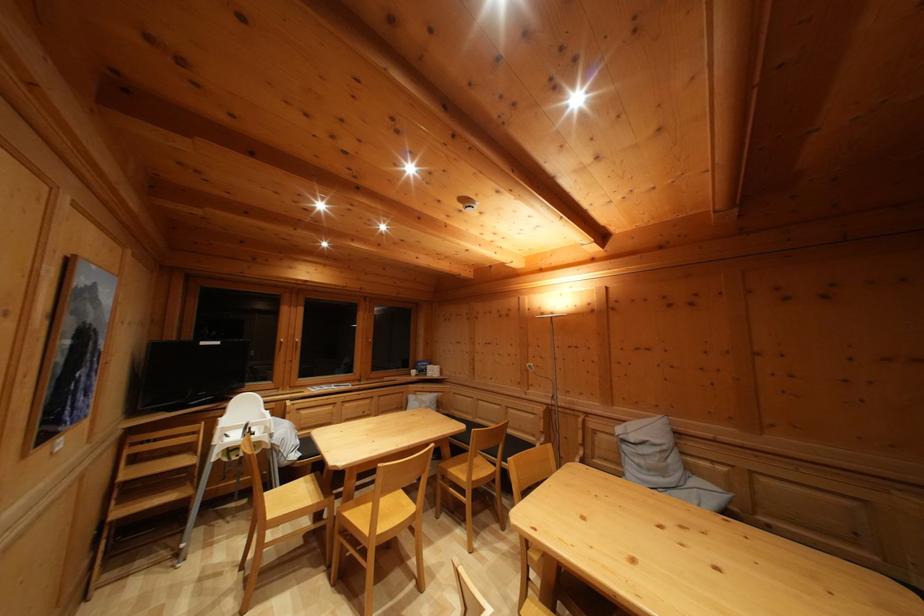
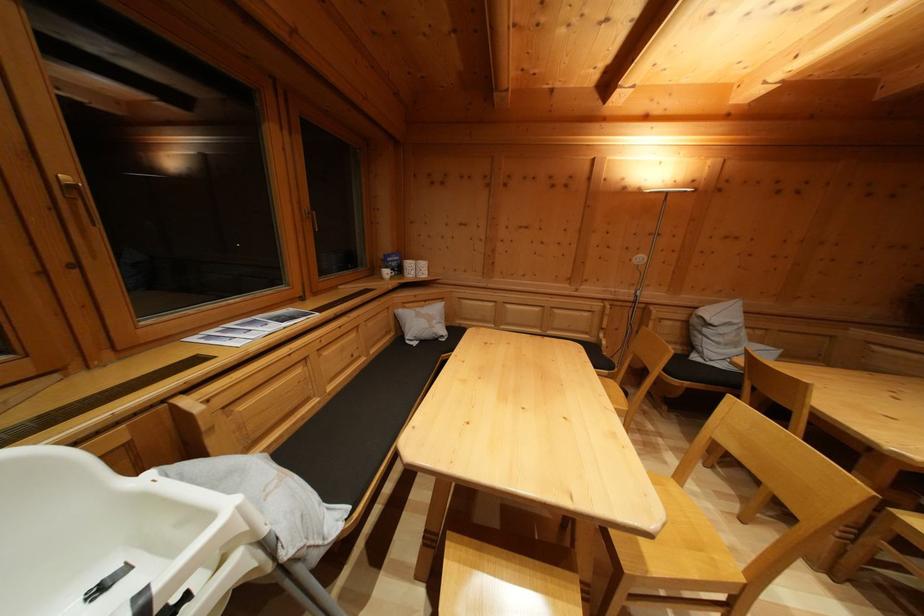
Where in the second image is the point corresponding to (x=436, y=399) from the first image?

(431, 308)